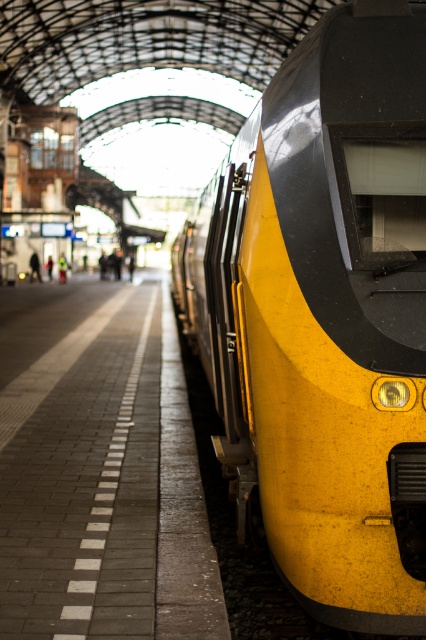
Question: Is yellow matte train at right to the right of brick platform at center from the viewer's perspective?

Choices:
 (A) no
 (B) yes

Answer: (B)

Question: Can you confirm if yellow matte train at right is positioned below brick platform at center?

Choices:
 (A) yes
 (B) no

Answer: (A)

Question: Which point is closer to the camera taking this photo?

Choices:
 (A) (120, 396)
 (B) (299, 195)

Answer: (B)

Question: Which point is closer to the camera taking this photo?

Choices:
 (A) (6, 428)
 (B) (417, 364)

Answer: (B)

Question: Can you confirm if yellow matte train at right is positioned below brick platform at center?

Choices:
 (A) yes
 (B) no

Answer: (A)